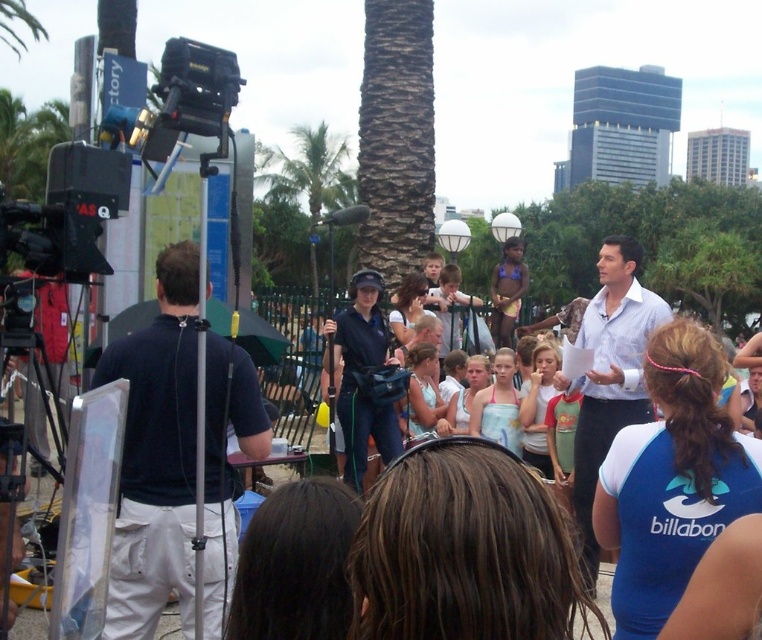
Does dark blue shirt at left appear under green leafy palm tree at center?

Indeed, dark blue shirt at left is positioned under green leafy palm tree at center.

Is dark blue shirt at left to the right of green leafy palm tree at center from the viewer's perspective?

Yes, dark blue shirt at left is to the right of green leafy palm tree at center.

Where is `dark blue shirt at left`? Image resolution: width=762 pixels, height=640 pixels. dark blue shirt at left is located at coordinates (155, 456).

Is white textured shirt at center positioned in front of green leafy palm tree at center?

Yes, it is in front of green leafy palm tree at center.

Can you confirm if white textured shirt at center is positioned to the left of green leafy palm tree at center?

In fact, white textured shirt at center is to the right of green leafy palm tree at center.

Is point (671, 314) closer to viewer compared to point (285, 177)?

Yes, it is.

At what (x,y) coordinates should I click in order to perform the action: click on white textured shirt at center. Please return your answer as a coordinate pair (x, y). The width and height of the screenshot is (762, 640). Looking at the image, I should click on (610, 376).

Can you confirm if dark blue shirt at left is positioned below white textured shirt at center?

No.

Who is shorter, dark blue shirt at left or white textured shirt at center?

dark blue shirt at left

Where is `dark blue shirt at left`? Image resolution: width=762 pixels, height=640 pixels. dark blue shirt at left is located at coordinates [155, 456].